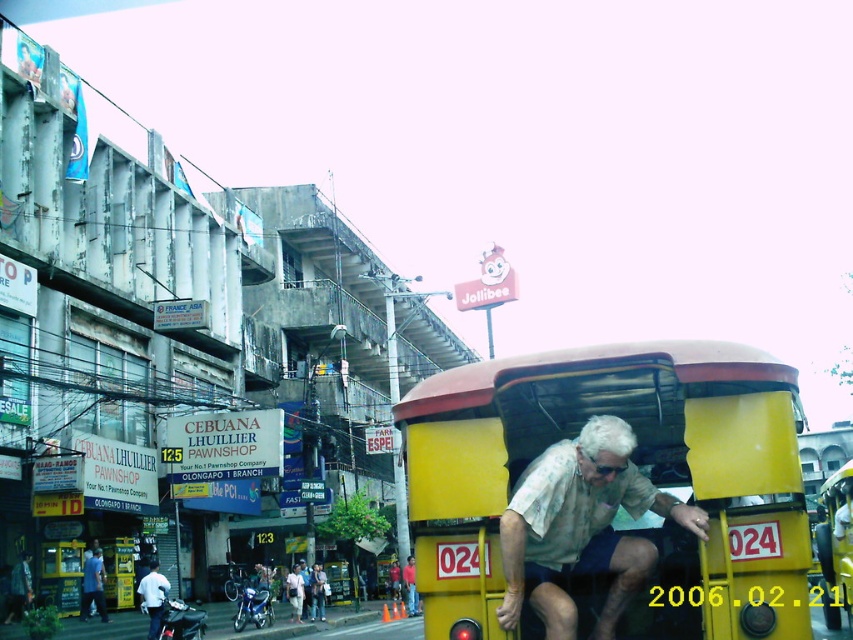
Question: Which point is closer to the camera taking this photo?

Choices:
 (A) (164, 592)
 (B) (315, 611)
 (C) (582, 497)
 (D) (85, 602)

Answer: (C)

Question: From the image, what is the correct spatial relationship of black matte motorcycle at lower left in relation to light blue shirt at lower left?

Choices:
 (A) below
 (B) above

Answer: (A)

Question: Which object is closer to the camera taking this photo?

Choices:
 (A) light brown fabric shirt at center
 (B) light brown fabric shirt at lower center

Answer: (A)

Question: Is the position of blue metallic motorcycle at lower left less distant than that of black matte motorcycle at lower left?

Choices:
 (A) yes
 (B) no

Answer: (B)

Question: Does blue metallic motorcycle at lower left appear on the left side of white matte coach at lower left?

Choices:
 (A) yes
 (B) no

Answer: (B)

Question: Which is nearer to the black matte motorcycle at lower left?

Choices:
 (A) light brown leather jacket at lower center
 (B) blue metallic motorcycle at lower left
 (C) white matte coach at lower left
 (D) light brown fabric shirt at lower center

Answer: (C)